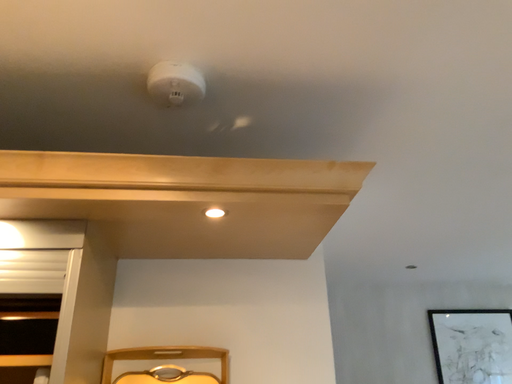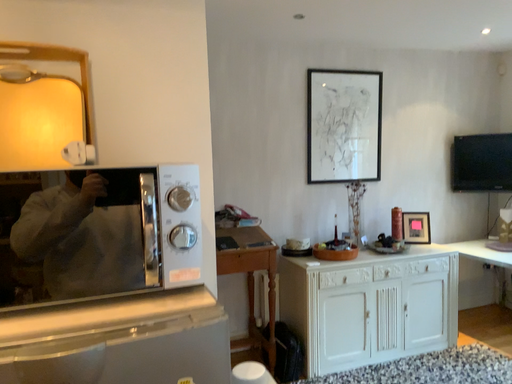
Question: How did the camera likely rotate when shooting the video?

Choices:
 (A) rotated downward
 (B) rotated upward

Answer: (A)